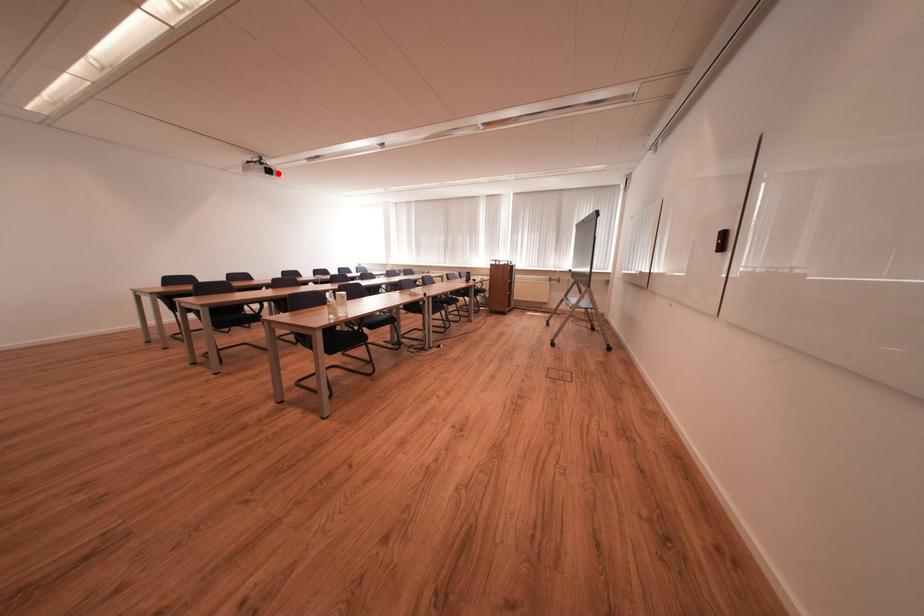
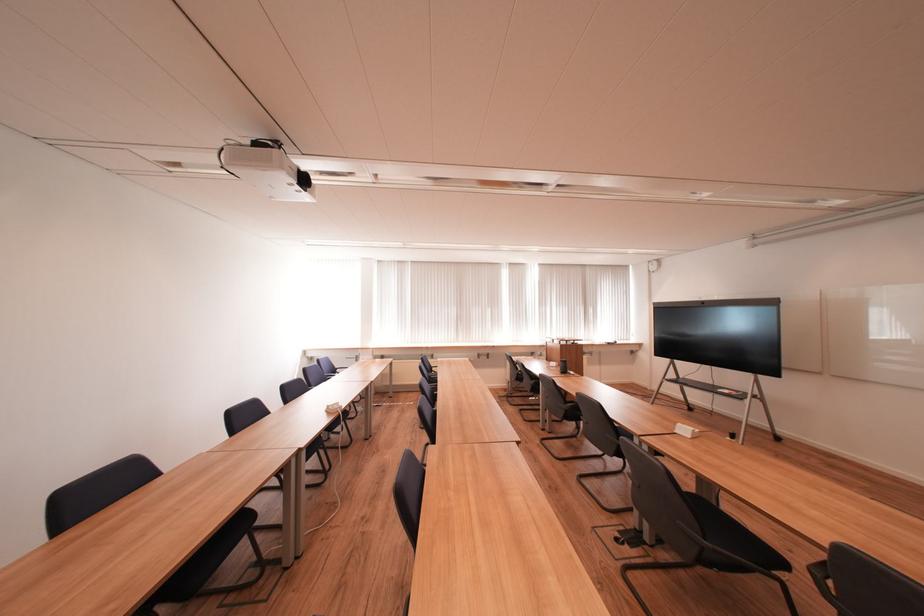
Question: I am providing you with two images of the same scene from different viewpoints. A red point is marked on the first image. Can you still see the location of the red point in image 2?

Choices:
 (A) Yes
 (B) No

Answer: (B)